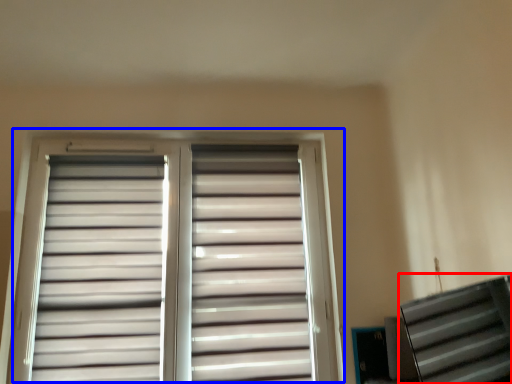
Question: Which of the following is the closest to the observer, stairwell (highlighted by a red box) or window (highlighted by a blue box)?

Choices:
 (A) stairwell
 (B) window

Answer: (A)